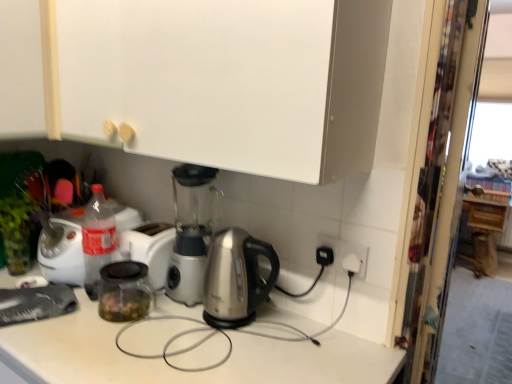
Question: Does white matte cabinet at upper left, which is the second cabinetry in front-to-back order, appear on the right side of white matte cabinet at upper center, the second cabinetry viewed from the right?

Choices:
 (A) yes
 (B) no

Answer: (B)

Question: Considering the relative positions of white matte cabinet at upper left, the 2th cabinetry viewed from the back, and white matte cabinet at upper center, arranged as the second cabinetry when viewed from the left, in the image provided, is white matte cabinet at upper left, the 2th cabinetry viewed from the back, to the left of white matte cabinet at upper center, arranged as the second cabinetry when viewed from the left, from the viewer's perspective?

Choices:
 (A) no
 (B) yes

Answer: (B)

Question: From a real-world perspective, is white matte cabinet at upper left, which is the second cabinetry in front-to-back order, on top of white matte cabinet at upper center, arranged as the third cabinetry when viewed from the back?

Choices:
 (A) yes
 (B) no

Answer: (B)

Question: Can you confirm if white matte cabinet at upper left, which is the second cabinetry in front-to-back order, is wider than white matte cabinet at upper center, the first cabinetry from the front?

Choices:
 (A) no
 (B) yes

Answer: (B)

Question: Is white matte cabinet at upper left, the 3th cabinetry positioned from the right, in contact with white matte cabinet at upper center, arranged as the second cabinetry when viewed from the left?

Choices:
 (A) no
 (B) yes

Answer: (A)

Question: From the image's perspective, is white matte cabinet at upper left, placed as the first cabinetry when sorted from left to right, located above or below transparent plastic screen door at right?

Choices:
 (A) below
 (B) above

Answer: (B)

Question: Is point (55, 84) positioned closer to the camera than point (452, 21)?

Choices:
 (A) closer
 (B) farther

Answer: (B)

Question: Considering the relative positions of white matte cabinet at upper left, placed as the first cabinetry when sorted from left to right, and transparent plastic screen door at right in the image provided, is white matte cabinet at upper left, placed as the first cabinetry when sorted from left to right, to the left or to the right of transparent plastic screen door at right?

Choices:
 (A) left
 (B) right

Answer: (A)

Question: Looking at the image, does white matte cabinet at upper left, which is the second cabinetry in front-to-back order, seem bigger or smaller compared to transparent plastic screen door at right?

Choices:
 (A) big
 (B) small

Answer: (B)

Question: From the image's perspective, is white matte cabinet at upper center, the first cabinetry from the front, located above or below satin silver kettle at center?

Choices:
 (A) below
 (B) above

Answer: (B)

Question: In terms of height, does white matte cabinet at upper center, the first cabinetry from the front, look taller or shorter compared to satin silver kettle at center?

Choices:
 (A) tall
 (B) short

Answer: (A)

Question: Considering the positions of point (29, 21) and point (112, 372), is point (29, 21) closer or farther from the camera than point (112, 372)?

Choices:
 (A) closer
 (B) farther

Answer: (B)

Question: Choose the correct answer: Is white matte cabinet at upper center, arranged as the third cabinetry when viewed from the back, inside satin silver kettle at center or outside it?

Choices:
 (A) outside
 (B) inside

Answer: (A)

Question: In the image, is wooden cabinet at right, the third cabinetry from the left, positioned in front of or behind transparent plastic screen door at right?

Choices:
 (A) behind
 (B) front

Answer: (A)

Question: From a real-world perspective, relative to transparent plastic screen door at right, is wooden cabinet at right, arranged as the third cabinetry when viewed from the front, vertically above or below?

Choices:
 (A) above
 (B) below

Answer: (B)